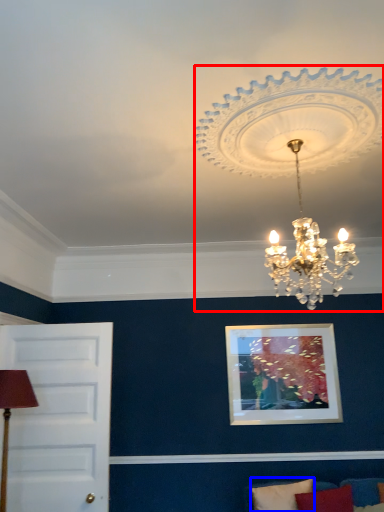
Question: Which point is closer to the camera, lamp (highlighted by a red box) or pillow (highlighted by a blue box)?

Choices:
 (A) lamp
 (B) pillow

Answer: (A)